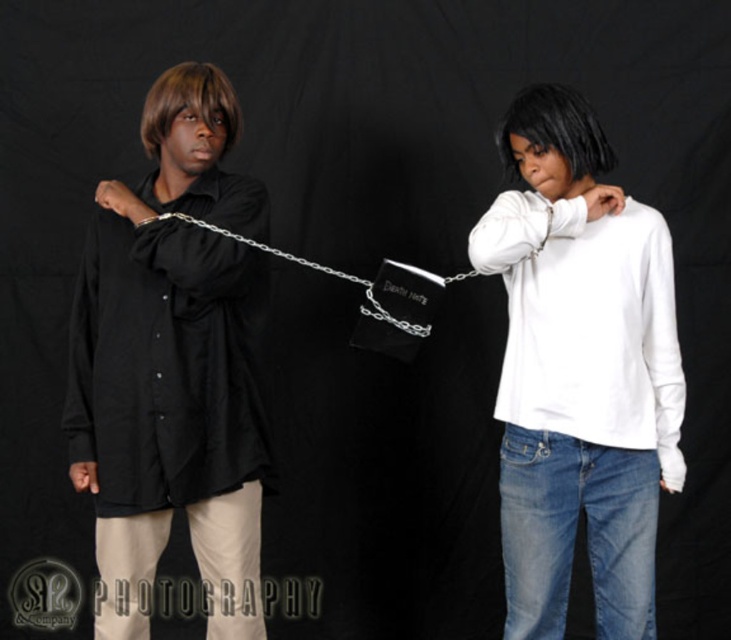
Is point (147, 620) farther from viewer compared to point (162, 218)?

Yes.

Which is more to the left, black matte shirt at left or metallic silver chain at center?

black matte shirt at left

Locate an element on the screen. This screenshot has width=731, height=640. black matte shirt at left is located at coordinates (173, 365).

This screenshot has height=640, width=731. What are the coordinates of `black matte shirt at left` in the screenshot? It's located at (173, 365).

Between point (102, 490) and point (523, 129), which one is positioned in front?

Point (523, 129) is more forward.

In order to click on black matte shirt at left in this screenshot , I will do `click(173, 365)`.

Between white matte shirt at center and metallic silver chain at center, which one appears on the right side from the viewer's perspective?

white matte shirt at center

Between white matte shirt at center and metallic silver chain at center, which one is positioned lower?

white matte shirt at center is below.

Is point (640, 337) positioned in front of point (159, 216)?

No, (640, 337) is behind (159, 216).

Find the location of a particular element. Image resolution: width=731 pixels, height=640 pixels. white matte shirt at center is located at coordinates 580,372.